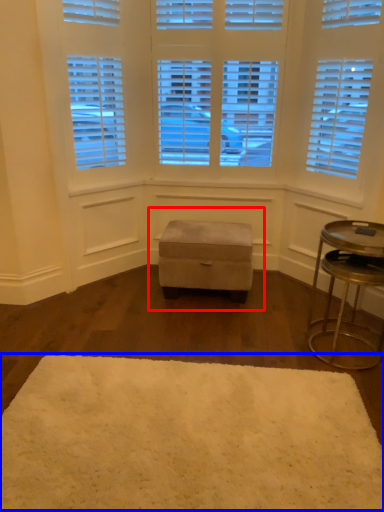
Question: Which object appears farthest to the camera in this image, music stool (highlighted by a red box) or mat (highlighted by a blue box)?

Choices:
 (A) music stool
 (B) mat

Answer: (A)